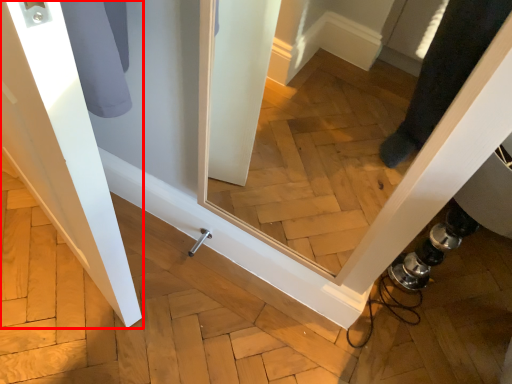
Question: From the image, what is the correct spatial relationship of door (annotated by the red box) in relation to door handle?

Choices:
 (A) right
 (B) left

Answer: (B)